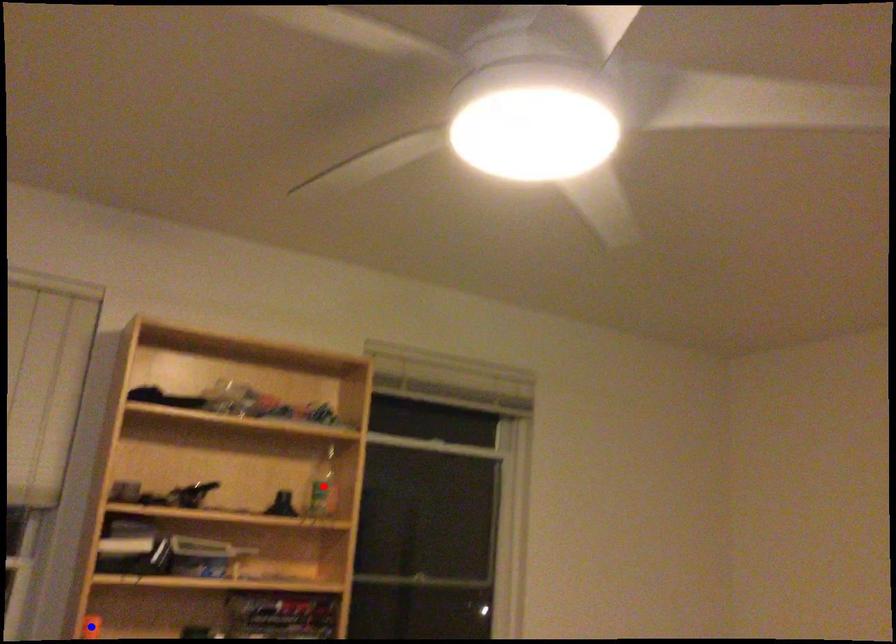
Question: Two points are marked on the image. Which point is closer to the camera?

Choices:
 (A) Blue point is closer.
 (B) Red point is closer.

Answer: (A)